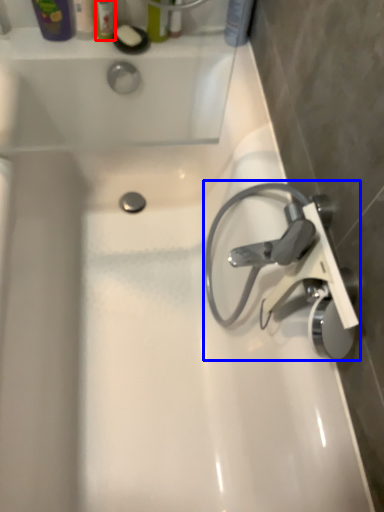
Question: Which object appears farthest to the camera in this image, toiletry (highlighted by a red box) or tap (highlighted by a blue box)?

Choices:
 (A) toiletry
 (B) tap

Answer: (A)